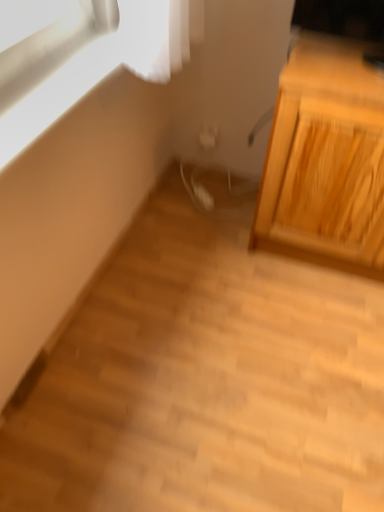
Locate an element on the screen. The image size is (384, 512). light wood cabinet at right is located at coordinates (325, 159).

What is the approximate width of light wood cabinet at right?

light wood cabinet at right is 22.30 inches wide.

Describe the element at coordinates (325, 159) in the screenshot. I see `light wood cabinet at right` at that location.

You are a GUI agent. You are given a task and a screenshot of the screen. Output one action in this format:
    pyautogui.click(x=<x>, y=<y>)
    Task: Click on the matte white window at upper left
    Image resolution: width=384 pixels, height=512 pixels.
    Given the screenshot: What is the action you would take?
    pyautogui.click(x=50, y=64)

Describe the element at coordinates (50, 64) in the screenshot. I see `matte white window at upper left` at that location.

What is the approximate height of matte white window at upper left?

matte white window at upper left is 4.44 centimeters tall.

This screenshot has width=384, height=512. What are the coordinates of `light wood cabinet at right` in the screenshot? It's located at (325, 159).

Visually, is matte white window at upper left positioned to the left or to the right of light wood cabinet at right?

matte white window at upper left is to the left of light wood cabinet at right.

Is matte white window at upper left closer to camera compared to light wood cabinet at right?

Yes, it is.

Does point (83, 27) lie in front of point (288, 147)?

Yes, point (83, 27) is in front of point (288, 147).

From the image's perspective, which object appears higher, matte white window at upper left or light wood cabinet at right?

matte white window at upper left, from the image's perspective.

From a real-world perspective, which is physically below, matte white window at upper left or light wood cabinet at right?

light wood cabinet at right is physically lower.

Between matte white window at upper left and light wood cabinet at right, which one has larger width?

With larger width is light wood cabinet at right.

Can you confirm if matte white window at upper left is taller than light wood cabinet at right?

No.

Who is smaller, matte white window at upper left or light wood cabinet at right?

Smaller between the two is matte white window at upper left.

Is light wood cabinet at right located within matte white window at upper left?

No, light wood cabinet at right is located outside of matte white window at upper left.

Is matte white window at upper left placed right next to light wood cabinet at right?

No, matte white window at upper left is not next to light wood cabinet at right.

Is matte white window at upper left turned away from light wood cabinet at right?

No, matte white window at upper left is not facing the opposite direction of light wood cabinet at right.

Can you tell me how much matte white window at upper left and light wood cabinet at right differ in facing direction?

The angle between the facing direction of matte white window at upper left and the facing direction of light wood cabinet at right is 90.2 degrees.

At what (x,y) coordinates should I click in order to perform the action: click on window that appears above the light wood cabinet at right (from the image's perspective). Please return your answer as a coordinate pair (x, y). This screenshot has height=512, width=384. Looking at the image, I should click on (50, 64).

Which object is positioned more to the left, light wood cabinet at right or matte white window at upper left?

From the viewer's perspective, matte white window at upper left appears more on the left side.

Is light wood cabinet at right behind matte white window at upper left?

Yes, light wood cabinet at right is further from the viewer.

Does point (339, 253) come behind point (25, 2)?

Yes, point (339, 253) is farther from viewer.

From the image's perspective, between light wood cabinet at right and matte white window at upper left, which one is located above?

matte white window at upper left appears higher in the image.

From a real-world perspective, which is physically above, light wood cabinet at right or matte white window at upper left?

matte white window at upper left, from a real-world perspective.

Considering the sizes of objects light wood cabinet at right and matte white window at upper left in the image provided, who is wider, light wood cabinet at right or matte white window at upper left?

light wood cabinet at right.

Considering the relative sizes of light wood cabinet at right and matte white window at upper left in the image provided, is light wood cabinet at right shorter than matte white window at upper left?

No, light wood cabinet at right is not shorter than matte white window at upper left.

Does light wood cabinet at right have a smaller size compared to matte white window at upper left?

Actually, light wood cabinet at right might be larger than matte white window at upper left.

Can we say light wood cabinet at right lies outside matte white window at upper left?

Yes.

Is there a large distance between light wood cabinet at right and matte white window at upper left?

No, light wood cabinet at right is in close proximity to matte white window at upper left.

Does light wood cabinet at right turn towards matte white window at upper left?

No, light wood cabinet at right is not turned towards matte white window at upper left.

How many degrees apart are the facing directions of light wood cabinet at right and matte white window at upper left?

The angular difference between light wood cabinet at right and matte white window at upper left is 90.2 degrees.

How much distance is there between light wood cabinet at right and matte white window at upper left?

A distance of 30.49 inches exists between light wood cabinet at right and matte white window at upper left.

Identify the location of cabinetry directly beneath the matte white window at upper left (from a real-world perspective). The image size is (384, 512). (325, 159).

Where is `window in front of the light wood cabinet at right`? Image resolution: width=384 pixels, height=512 pixels. window in front of the light wood cabinet at right is located at coordinates (50, 64).

Locate an element on the screen. The height and width of the screenshot is (512, 384). cabinetry located behind the matte white window at upper left is located at coordinates (325, 159).